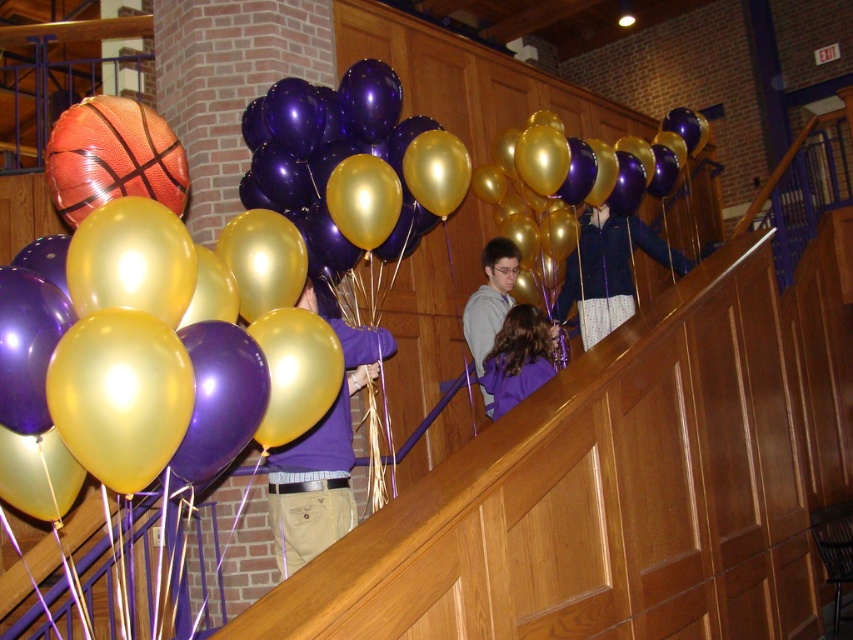
You are standing in the gymnasium and want to know how far the point at coordinates (430, 225) is from you. Can you determine the distance?

The point at coordinates (430, 225) is 4.56 meters away from the viewer.